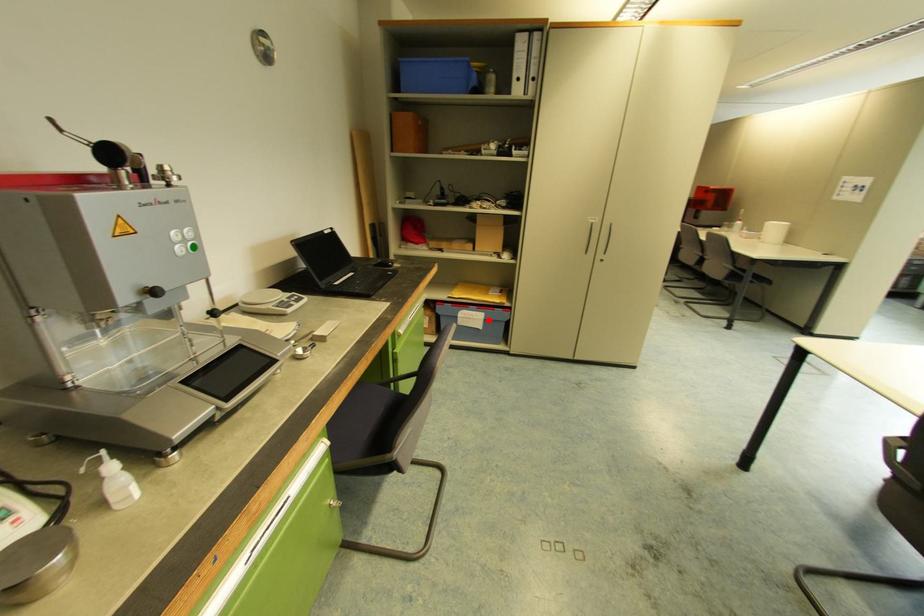
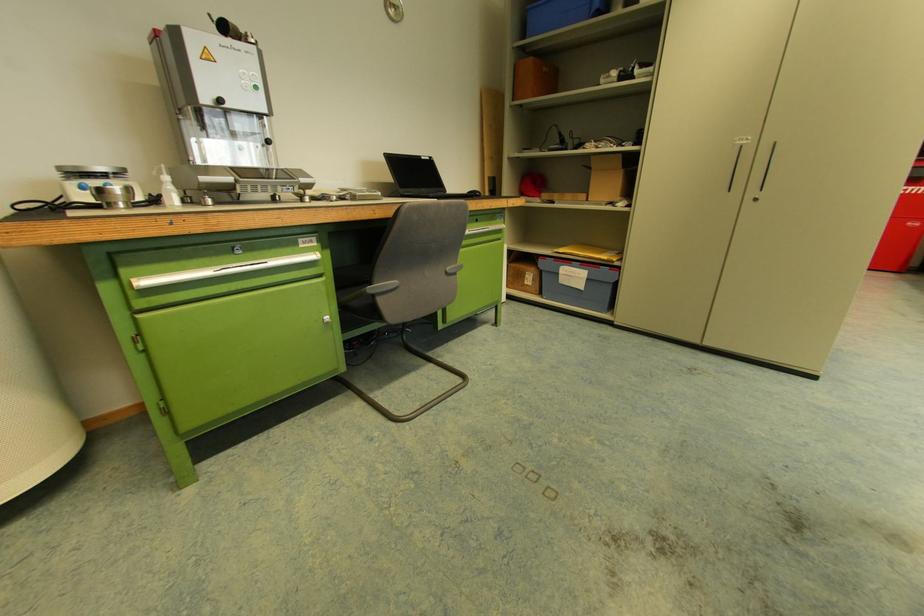
Find the pixel in the second image that matches the highlighted location in the first image.

(591, 280)